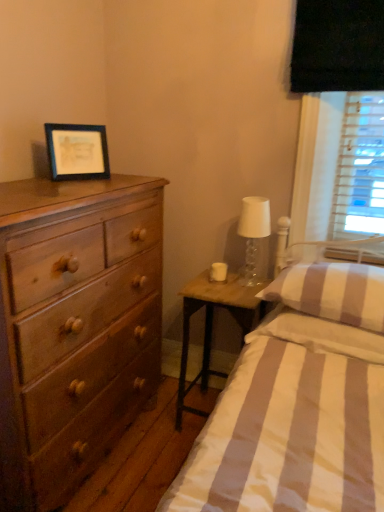
This screenshot has width=384, height=512. In order to click on vacant area located to the right-hand side of matte black picture frame at upper left in this screenshot , I will do `click(126, 183)`.